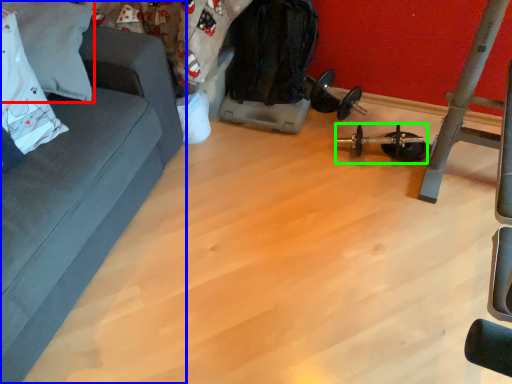
Question: Which is nearer to the pillow (highlighted by a red box)? studio couch (highlighted by a blue box) or equipment (highlighted by a green box).

Choices:
 (A) studio couch
 (B) equipment

Answer: (A)